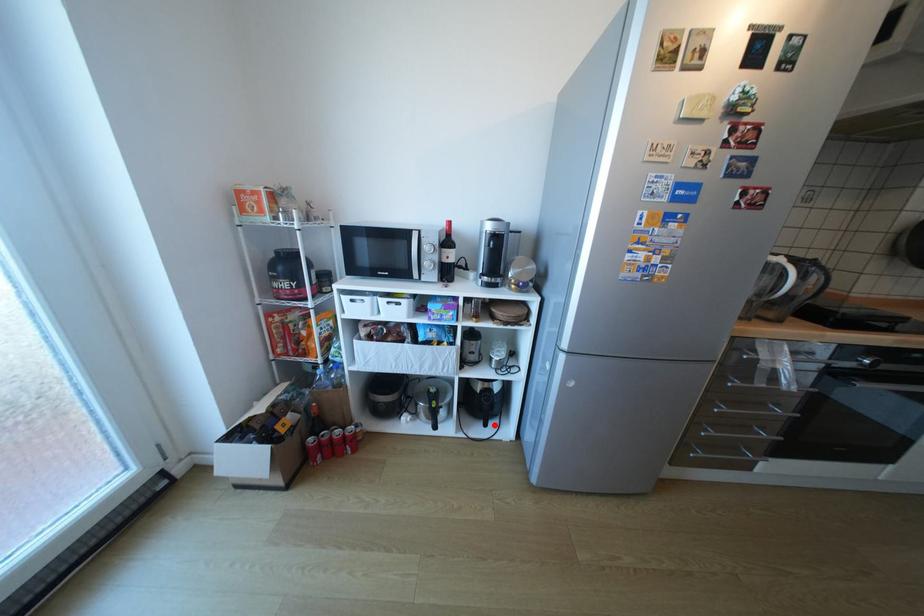
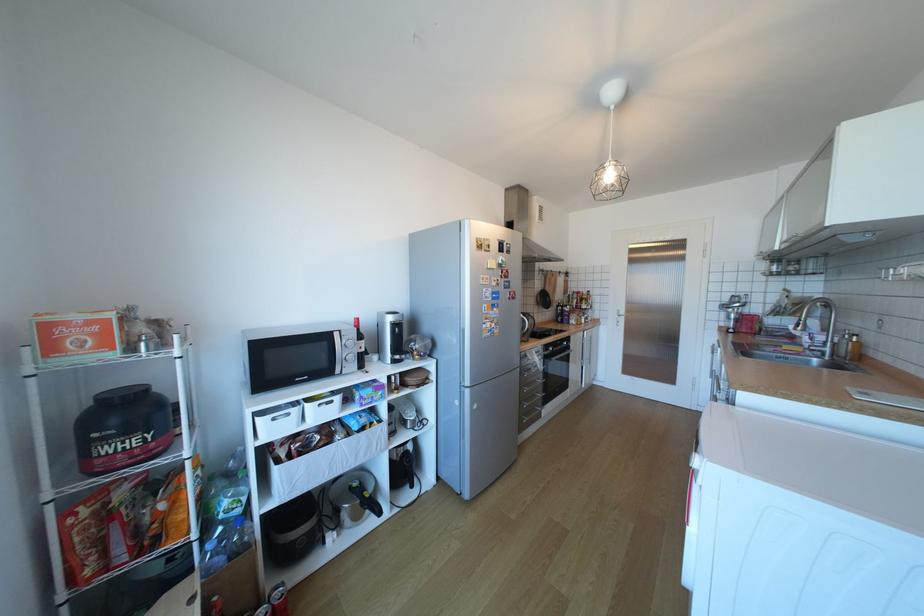
Where in the second image is the point corresponding to the highlighted location from the first image?

(420, 485)